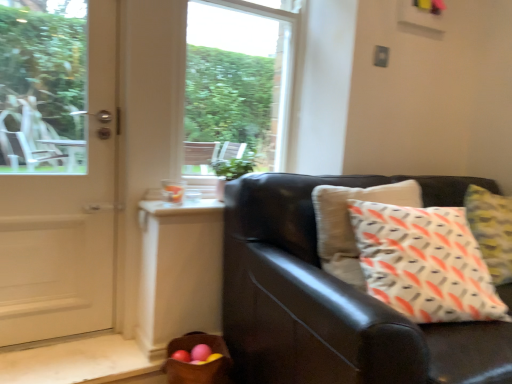
Question: Should I look upward or downward to see white glossy door at left?

Choices:
 (A) down
 (B) up

Answer: (B)

Question: From a real-world perspective, is brown woven basket at lower left beneath transparent glass window at center?

Choices:
 (A) yes
 (B) no

Answer: (A)

Question: Is brown woven basket at lower left positioned far away from transparent glass window at center?

Choices:
 (A) yes
 (B) no

Answer: (A)

Question: Considering the relative positions of brown woven basket at lower left and transparent glass window at center in the image provided, is brown woven basket at lower left to the right of transparent glass window at center from the viewer's perspective?

Choices:
 (A) no
 (B) yes

Answer: (A)

Question: Can you confirm if brown woven basket at lower left is smaller than transparent glass window at center?

Choices:
 (A) no
 (B) yes

Answer: (B)

Question: Is brown woven basket at lower left facing away from transparent glass window at center?

Choices:
 (A) yes
 (B) no

Answer: (B)

Question: Considering the relative sizes of brown woven basket at lower left and transparent glass window at center in the image provided, is brown woven basket at lower left thinner than transparent glass window at center?

Choices:
 (A) yes
 (B) no

Answer: (B)

Question: Is matte black couch at right far away from white glossy door at left?

Choices:
 (A) yes
 (B) no

Answer: (B)

Question: Does matte black couch at right lie in front of white glossy door at left?

Choices:
 (A) no
 (B) yes

Answer: (B)

Question: From the image's perspective, is matte black couch at right over white glossy door at left?

Choices:
 (A) yes
 (B) no

Answer: (B)

Question: Is matte black couch at right aimed at white glossy door at left?

Choices:
 (A) yes
 (B) no

Answer: (B)

Question: Can you confirm if matte black couch at right is taller than white glossy door at left?

Choices:
 (A) yes
 (B) no

Answer: (B)

Question: Can you confirm if matte black couch at right is thinner than white glossy door at left?

Choices:
 (A) yes
 (B) no

Answer: (B)

Question: Is white glossy door at left next to transparent glass window at center?

Choices:
 (A) yes
 (B) no

Answer: (B)